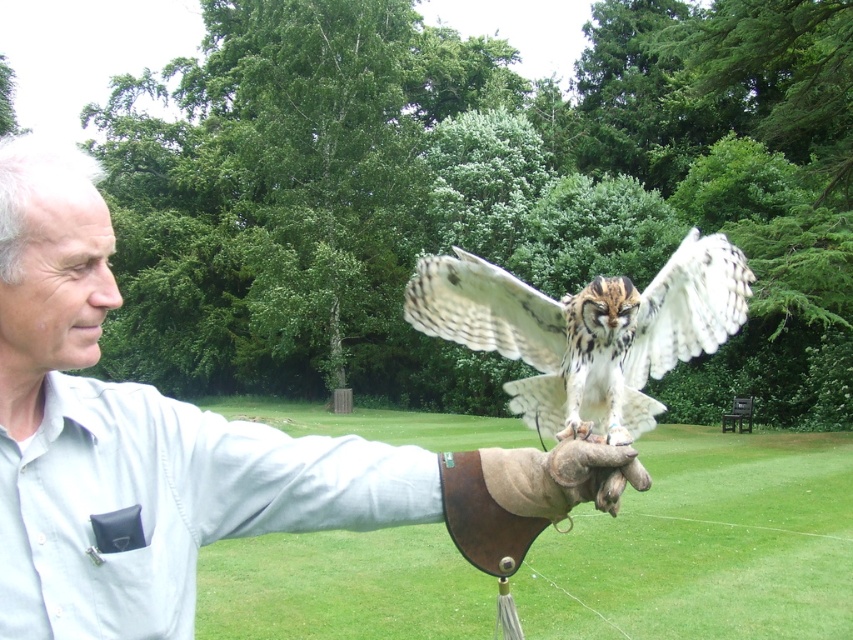
You are a photographer trying to capture the owl in the scene. The owl is at point (585, 330). If you move your camera 0.1 units to the right along the x axis, will the owl still be in the frame?

The point (585, 330) corresponds to white feathered owl at center. Moving the camera 0.1 units to the right along the x axis would shift the frame, but since the owl is at the center, it should remain within the frame unless the shift exceeds the frame boundaries. However, without knowing the frame size, it is impossible to determine for sure. But given typical framing, the owl likely stays in view.

You are a wildlife photographer aiming to capture a closeup shot of the white feathered owl at center. You have a camera with a 100mm lens. Considering the owl is larger than the leather glove at center, which is on the photographer hand, will the owl fit entirely within the camera frame?

The white feathered owl at center is larger in size than the leather glove at center. Since the glove is on the photographer hand, the owl is bigger, so it may not fit entirely within the camera frame if the lens is only 100mm. A longer lens might be needed for a closer shot.

You are a wildlife photographer aiming to capture the owl in the scene. Based on the sizes of the white feathered owl at center and the brown leather glove at center, which one would you focus on first to ensure the owl is clearly visible in your photo?

The white feathered owl at center is smaller than the brown leather glove at center, so you should focus on the owl first to ensure its details are clear due to its smaller size.